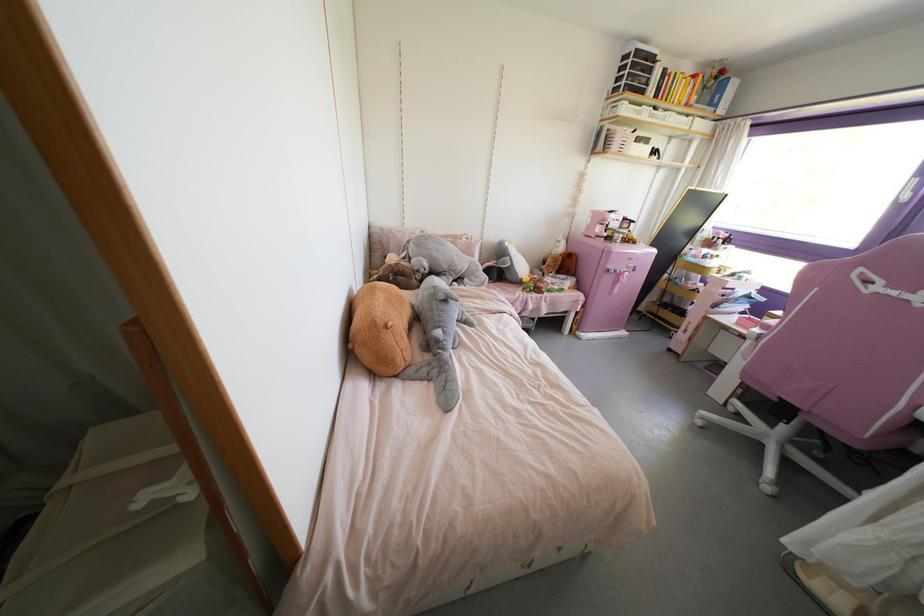
Find the location of a particular element. This screenshot has height=616, width=924. refrigerator door handle is located at coordinates (621, 275).